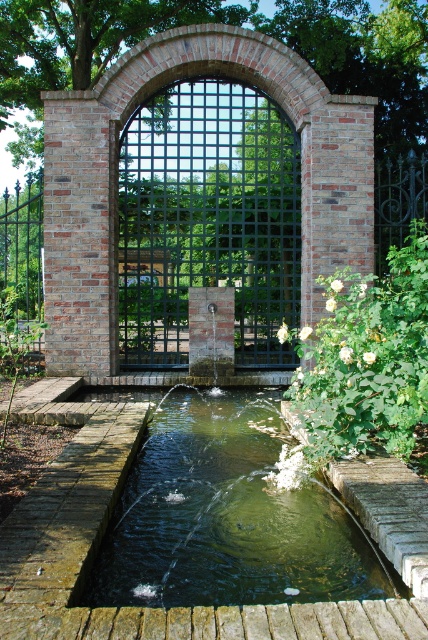
Is clear glass pond at center to the left of green metal gate at center from the viewer's perspective?

Incorrect, clear glass pond at center is not on the left side of green metal gate at center.

Is clear glass pond at center behind green metal gate at center?

That is False.

At what (x,y) coordinates should I click in order to perform the action: click on clear glass pond at center. Please return your answer as a coordinate pair (x, y). This screenshot has width=428, height=640. Looking at the image, I should click on (226, 512).

Is clear glass pond at center positioned before white matte flowers at right?

That is True.

Between clear glass pond at center and white matte flowers at right, which one has more height?

With more height is white matte flowers at right.

Who is more distant from viewer, (x=265, y=412) or (x=366, y=417)?

The point (x=265, y=412) is more distant.

Where is `clear glass pond at center`? The image size is (428, 640). clear glass pond at center is located at coordinates tap(226, 512).

Can you confirm if green metal gate at center is positioned above white matte flowers at right?

Correct, green metal gate at center is located above white matte flowers at right.

Is the position of green metal gate at center more distant than that of white matte flowers at right?

That is True.

This screenshot has width=428, height=640. Describe the element at coordinates (208, 220) in the screenshot. I see `green metal gate at center` at that location.

Find the location of `green metal gate at center`. green metal gate at center is located at coordinates (208, 220).